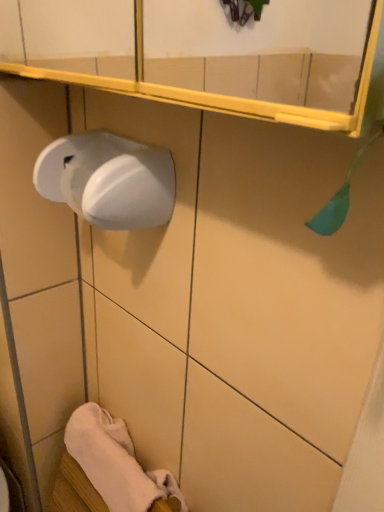
Locate an element on the screen. This screenshot has height=512, width=384. white glossy soap dispenser at left is located at coordinates (288, 274).

Which object is positioned more to the right, white soft towel at lower left or white glossy paper towel at left?

From the viewer's perspective, white glossy paper towel at left appears more on the right side.

Does point (102, 484) lie behind point (154, 198)?

Yes.

Find the location of a particular element. This screenshot has width=384, height=512. paper towel lying above the white soft towel at lower left (from the image's perspective) is located at coordinates (108, 180).

Is white soft towel at lower left not within white glossy soap dispenser at left?

Indeed, white soft towel at lower left is completely outside white glossy soap dispenser at left.

From the image's perspective, which is above, white soft towel at lower left or white glossy soap dispenser at left?

white glossy soap dispenser at left, from the image's perspective.

Is there a large distance between white soft towel at lower left and white glossy soap dispenser at left?

Actually, white soft towel at lower left and white glossy soap dispenser at left are a little close together.

Can you tell me how much white soft towel at lower left and white glossy soap dispenser at left differ in facing direction?

The angle between the facing direction of white soft towel at lower left and the facing direction of white glossy soap dispenser at left is 90.3 degrees.

Considering the sizes of objects white glossy soap dispenser at left and white glossy paper towel at left in the image provided, who is wider, white glossy soap dispenser at left or white glossy paper towel at left?

white glossy paper towel at left is wider.

Considering the sizes of objects white glossy soap dispenser at left and white glossy paper towel at left in the image provided, who is bigger, white glossy soap dispenser at left or white glossy paper towel at left?

white glossy soap dispenser at left is bigger.

In the image, is white glossy soap dispenser at left positioned in front of or behind white soft towel at lower left?

white glossy soap dispenser at left is positioned closer to the viewer than white soft towel at lower left.

Can white soft towel at lower left be found inside white glossy soap dispenser at left?

Actually, white soft towel at lower left is outside white glossy soap dispenser at left.

Between white glossy soap dispenser at left and white soft towel at lower left, which one has more height?

white glossy soap dispenser at left is taller.

Is white glossy soap dispenser at left completely or partially inside white glossy paper towel at left?

No, white glossy soap dispenser at left is not surrounded by white glossy paper towel at left.

Is white glossy paper towel at left oriented towards white glossy soap dispenser at left?

No, white glossy paper towel at left is not aimed at white glossy soap dispenser at left.

From the image's perspective, is white glossy paper towel at left above white glossy soap dispenser at left?

Correct, white glossy paper towel at left appears higher than white glossy soap dispenser at left in the image.

In the image, is white glossy paper towel at left positioned in front of or behind white glossy soap dispenser at left?

white glossy paper towel at left is behind white glossy soap dispenser at left.

Is white glossy paper towel at left looking in the opposite direction of white soft towel at lower left?

No.

Are white glossy paper towel at left and white soft towel at lower left beside each other?

No, white glossy paper towel at left is not next to white soft towel at lower left.

From the image's perspective, relative to white soft towel at lower left, is white glossy paper towel at left above or below?

white glossy paper towel at left is above white soft towel at lower left.

Find the location of a particular element. bath towel lying below the white glossy paper towel at left (from the image's perspective) is located at coordinates tap(109, 459).

Locate an element on the screen. paper towel lying above the white soft towel at lower left (from the image's perspective) is located at coordinates [x=108, y=180].

In order to click on tile on the right of white soft towel at lower left in this screenshot , I will do `click(288, 274)`.

Considering their positions, is white glossy paper towel at left positioned further to white soft towel at lower left than white glossy soap dispenser at left?

Among the two, white glossy paper towel at left is located further to white soft towel at lower left.

When comparing their distances from white glossy soap dispenser at left, does white soft towel at lower left or white glossy paper towel at left seem further?

Among the two, white soft towel at lower left is located further to white glossy soap dispenser at left.

Looking at the image, which one is located further to white soft towel at lower left, white glossy soap dispenser at left or white glossy paper towel at left?

white glossy paper towel at left is further to white soft towel at lower left.

From the image, which object appears to be farther from white glossy paper towel at left, white glossy soap dispenser at left or white soft towel at lower left?

Based on the image, white soft towel at lower left appears to be further to white glossy paper towel at left.

Which object lies nearer to the anchor point white glossy paper towel at left, white soft towel at lower left or white glossy soap dispenser at left?

white glossy soap dispenser at left is closer to white glossy paper towel at left.

When comparing their distances from white glossy soap dispenser at left, does white glossy paper towel at left or white soft towel at lower left seem closer?

white glossy paper towel at left is closer to white glossy soap dispenser at left.

What are the coordinates of `tile between white glossy paper towel at left and white soft towel at lower left in the vertical direction` in the screenshot? It's located at (288, 274).